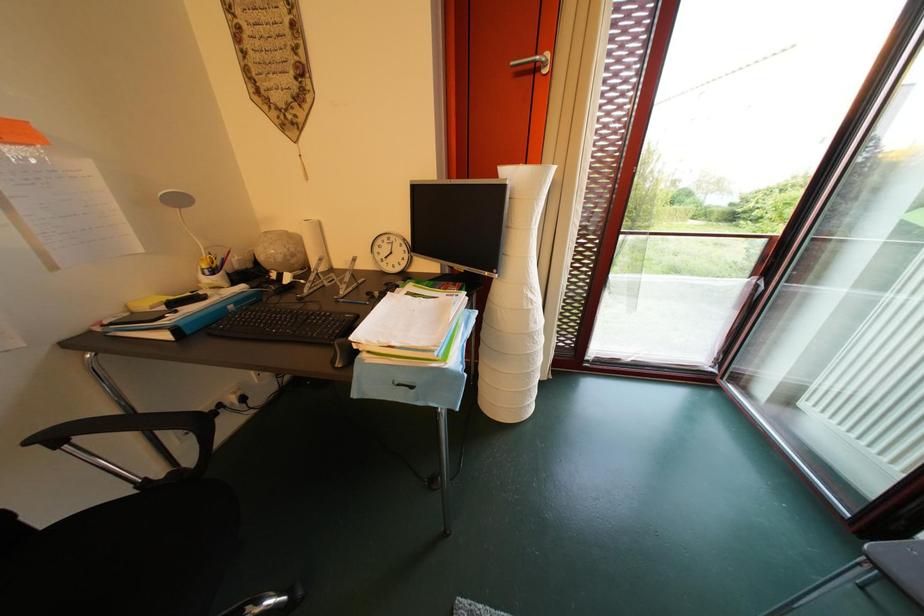
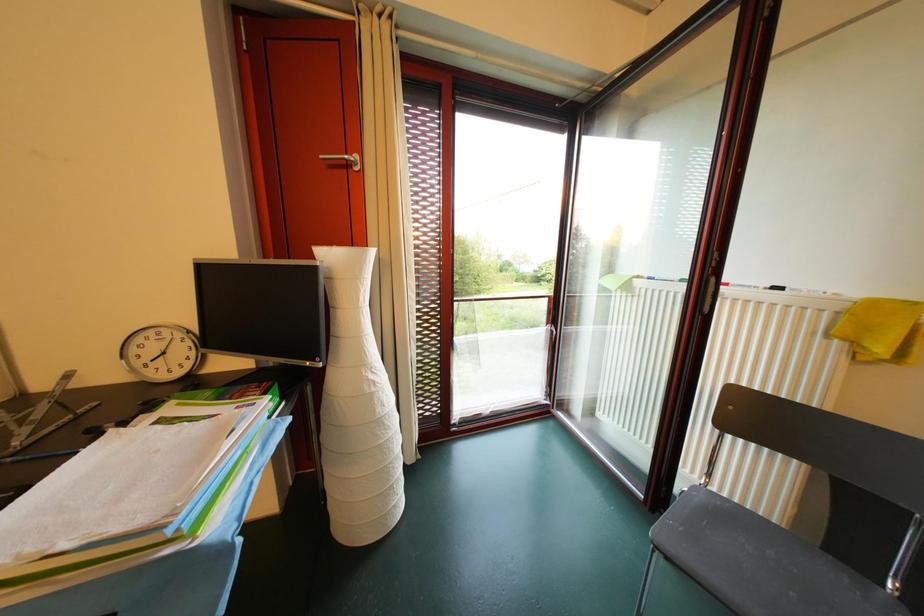
Question: The images are taken continuously from a first-person perspective. In which direction is your viewpoint rotating?

Choices:
 (A) Left
 (B) Right
 (C) Up
 (D) Down

Answer: (B)